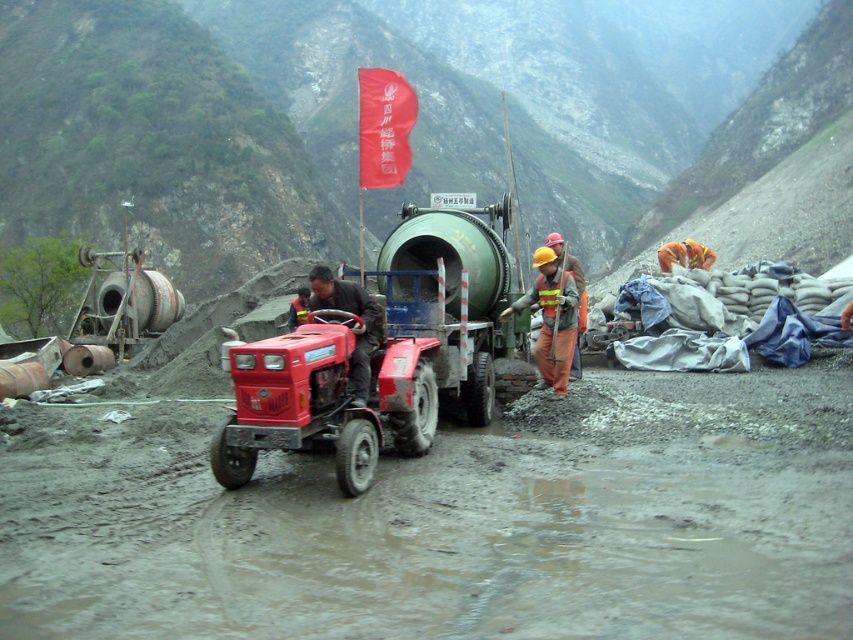
Question: Where is red matte tractor at center located in relation to orange reflective vest at center in the image?

Choices:
 (A) below
 (B) above

Answer: (A)

Question: Considering the real-world distances, which object is farthest from the brown leather jacket at center?

Choices:
 (A) red matte tractor at center
 (B) red fabric flag at upper center

Answer: (B)

Question: Is red fabric flag at upper center above yellow reflective safety vest at center?

Choices:
 (A) no
 (B) yes

Answer: (B)

Question: Estimate the real-world distances between objects in this image. Which object is farther from the orange reflective vest at center?

Choices:
 (A) red matte tractor at center
 (B) yellow reflective safety vest at center

Answer: (A)

Question: Is red matte tractor at center positioned behind brown leather jacket at center?

Choices:
 (A) no
 (B) yes

Answer: (B)

Question: Which of these objects is positioned farthest from the brown leather jacket at center?

Choices:
 (A) yellow reflective safety vest at center
 (B) orange reflective vest at center
 (C) red fabric flag at upper center
 (D) red matte tractor at center

Answer: (C)